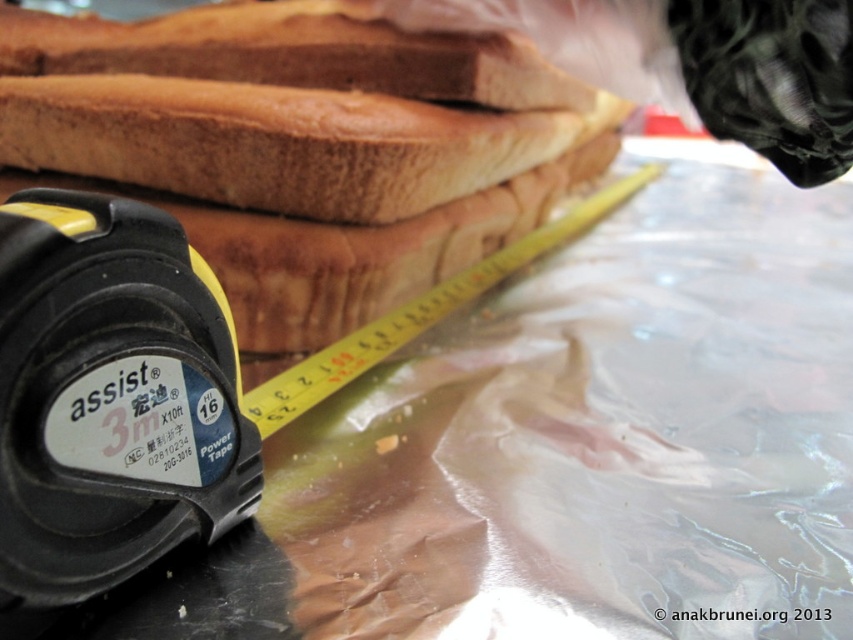
You are holding a 3M measuring tape and want to measure the distance from the camera to the point labeled as point (132,556). Can the tape measure this distance accurately?

The distance between point (132,556) and the camera is 26.01 inches. Since the 3M measuring tape can measure up to 16 feet, which is 192 inches, it is well within the tape measure range. Therefore, the tape can measure this distance accurately.

You are trying to measure the distance between the black rubber tape measure at lower left and the stack of bread slices in the background. Can you determine if the tape measure is positioned to the left or right of the bread stack?

The black rubber tape measure at lower left is located at point (109, 397), which places it to the right of the bread stack in the background.